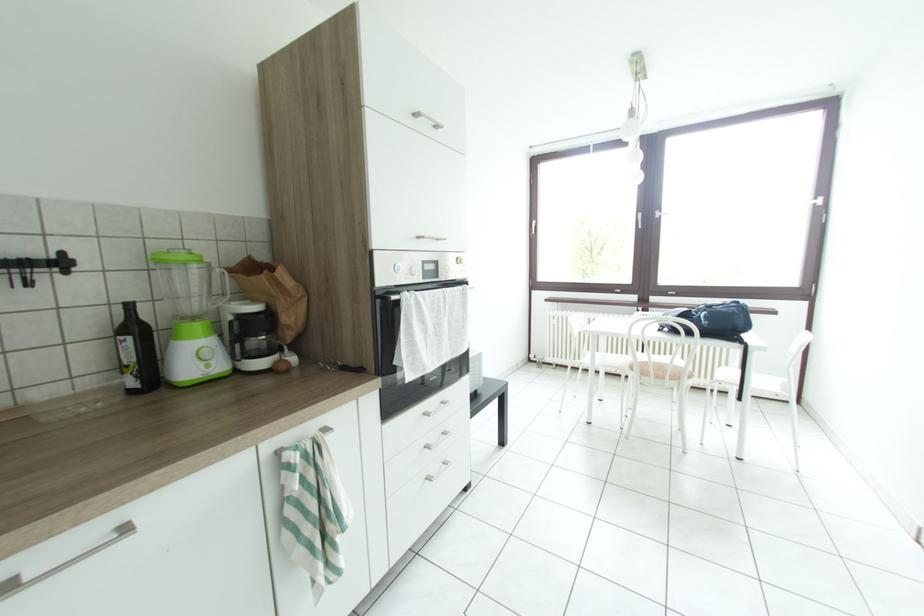
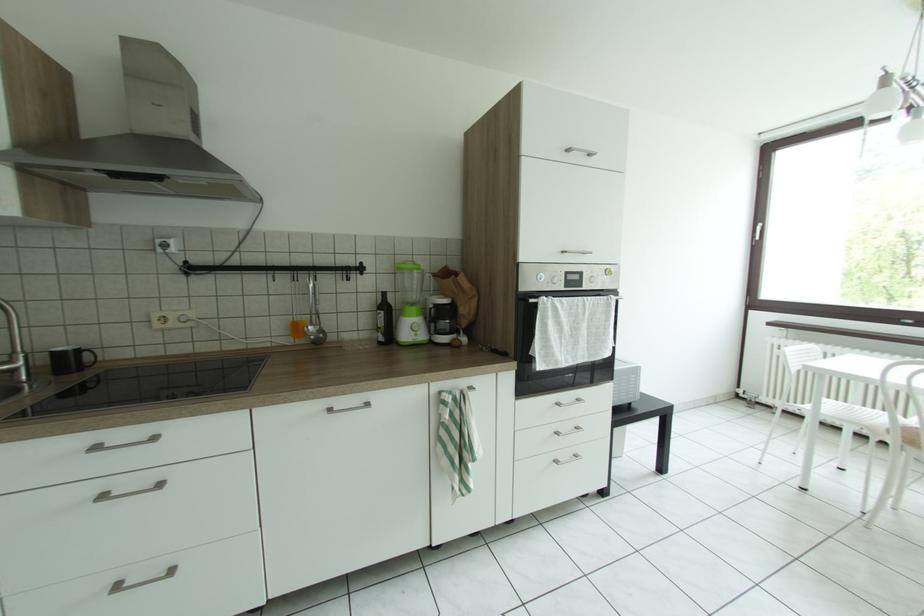
Question: The camera is either moving clockwise (left) or counter-clockwise (right) around the object. The first image is from the beginning of the video and the second image is from the end. Is the camera moving left or right when shooting the video?

Choices:
 (A) Left
 (B) Right

Answer: (B)